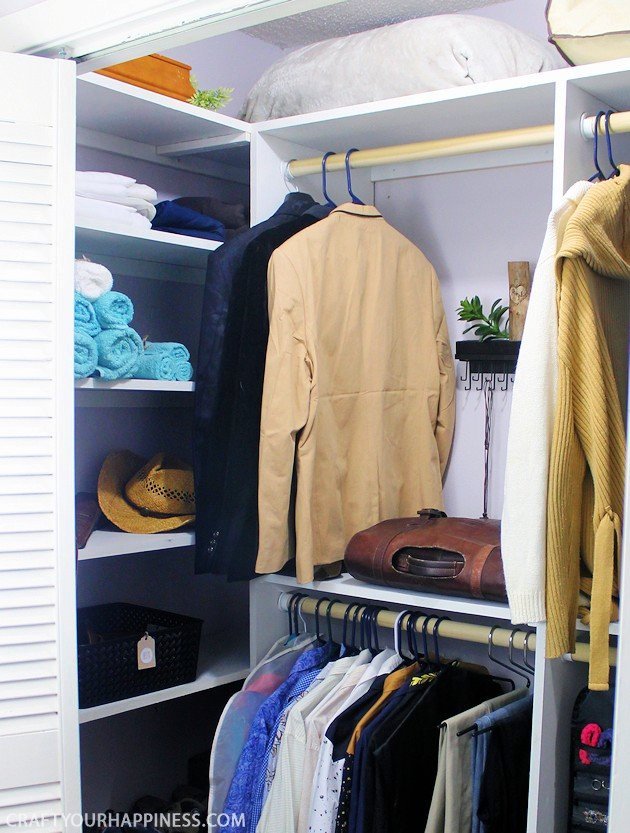
You are a GUI agent. You are given a task and a screenshot of the screen. Output one action in this format:
    pyautogui.click(x=<x>, y=<y>)
    Task: Click on the blue hooks on hangers
    The image size is (630, 833).
    Given the screenshot: What is the action you would take?
    pyautogui.click(x=323, y=157), pyautogui.click(x=346, y=157), pyautogui.click(x=595, y=118), pyautogui.click(x=605, y=117)